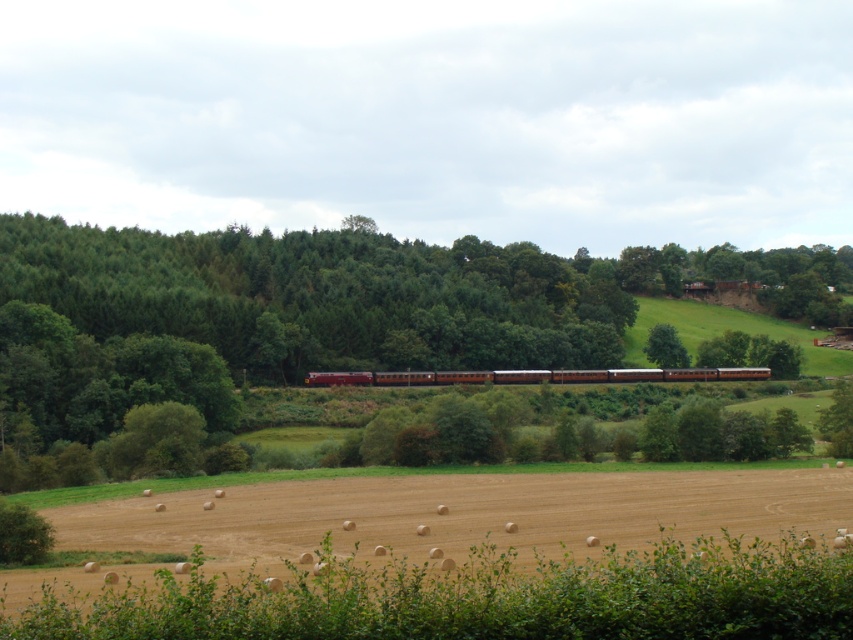
You are standing in the field with the hay bales and want to take a photo of the brown polished wood passenger train at center and the green leafy tree at upper center. Which object should you focus on first if you want both to be in sharp focus?

The brown polished wood passenger train at center is in front of the green leafy tree at upper center, so you should focus on the brown polished wood passenger train at center first to ensure both are in sharp focus.

You are standing in the field with the hay bales and want to take a photo of the green leafy tree at center and the brown polished wood passenger train at center. Which object should you frame first in your camera viewfinder to ensure both are in the shot?

You should frame the green leafy tree at center first since it is positioned to the left of the brown polished wood passenger train at center, allowing both to be captured in the same frame.